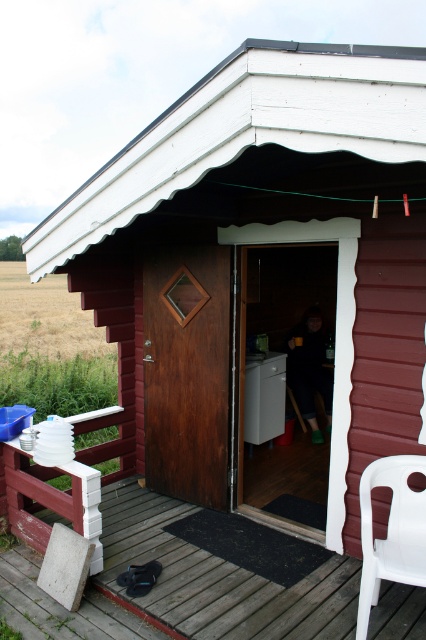
You are standing on the porch of the cabin and want to sit down. The white plastic chair at lower right is currently occupied by the dark brown leather jacket at center. Can you sit on the chair without moving the jacket?

The white plastic chair at lower right is positioned under dark brown leather jacket at center, meaning the jacket is likely draped over the chair. Since the jacket is on the chair, you would need to move it to sit down.

You are standing outside the cabin and want to place the dark brown leather jacket at center on the wooden deck at lower left. Can you do this without needing to climb or step onto anything taller than the deck?

The wooden deck at lower left is not as tall as the dark brown leather jacket at center, so you can place the jacket on the deck without needing to climb or step onto anything taller than the deck.

You are standing outside the cabin and want to place a new potted plant between the wooden deck at lower left and the dark brown leather jacket at center. Is there enough space to place the plant between them?

The wooden deck at lower left is to the left of the dark brown leather jacket at center, so there is space between them to place the potted plant.